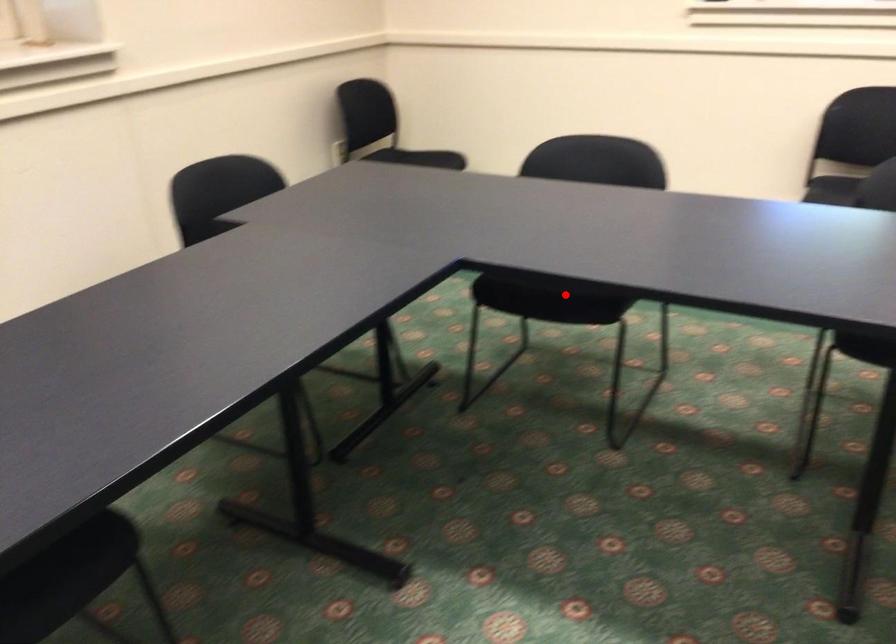
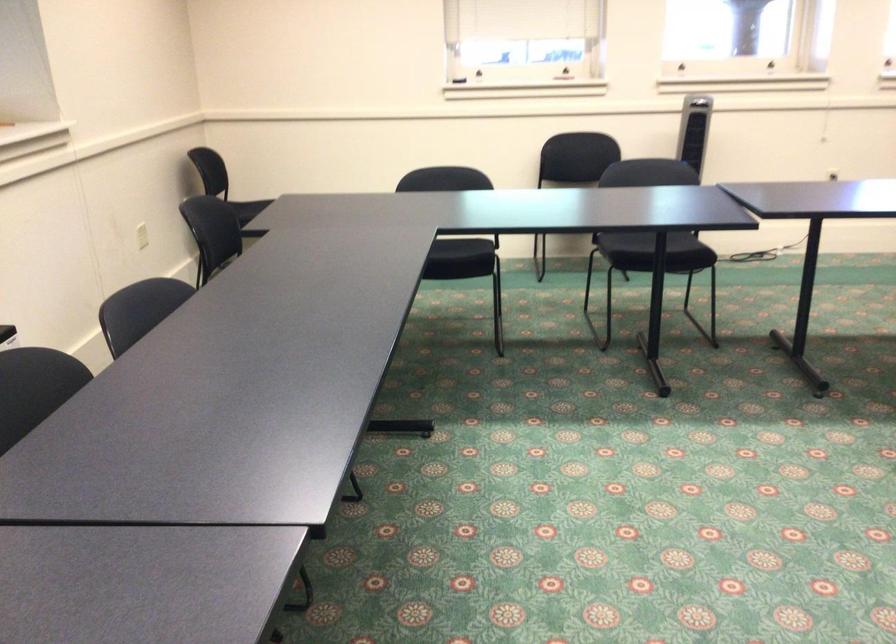
Question: A red point is marked in image1. In image2, is the corresponding 3D point closer to the camera or farther? Reply with the corresponding letter.

Choices:
 (A) The corresponding 3D point is closer.
 (B) The corresponding 3D point is farther.

Answer: (B)